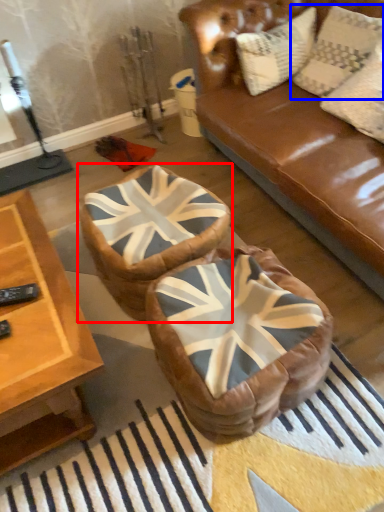
Question: Which point is closer to the camera, bean bag chair (highlighted by a red box) or pillow (highlighted by a blue box)?

Choices:
 (A) bean bag chair
 (B) pillow

Answer: (A)